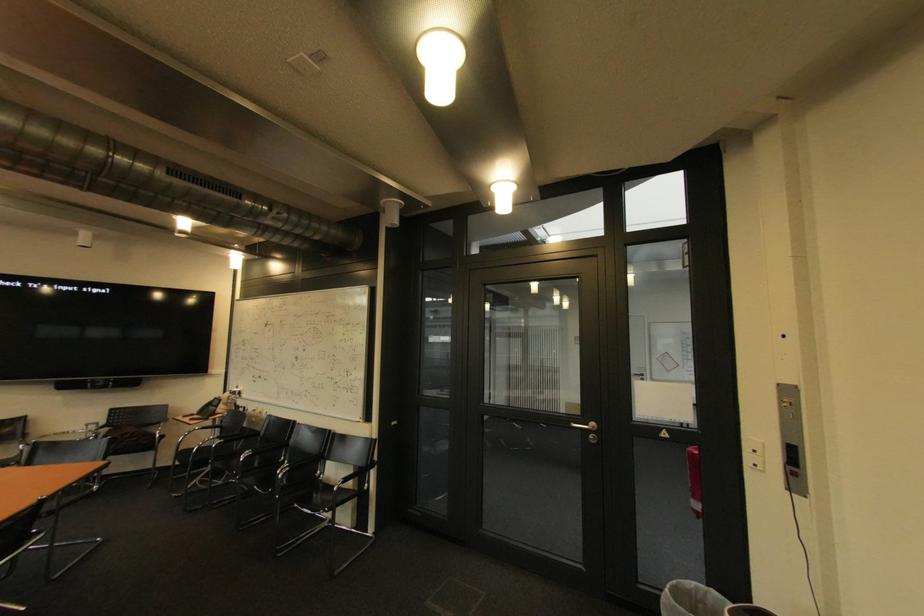
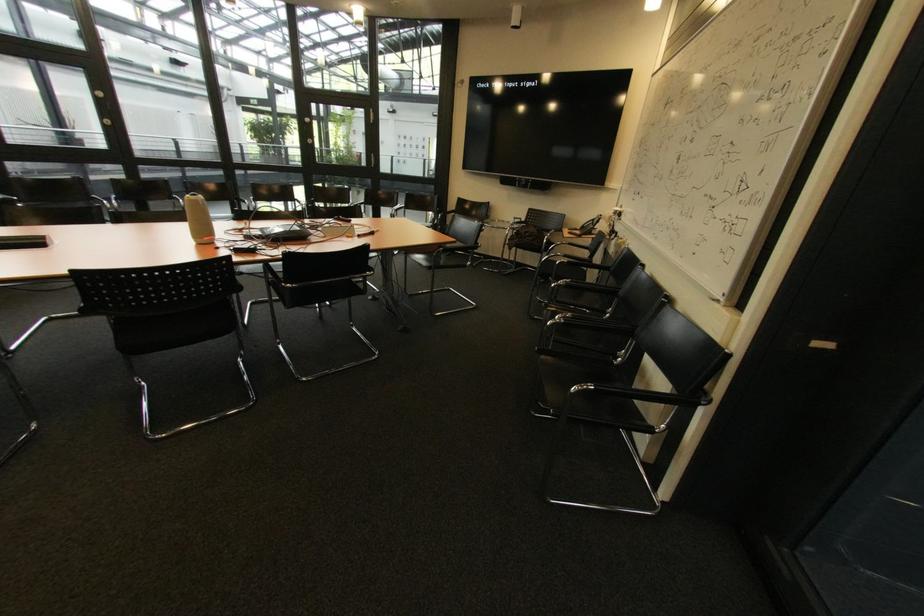
Find the pixel in the second image that matches [286,472] in the first image.

(565, 318)